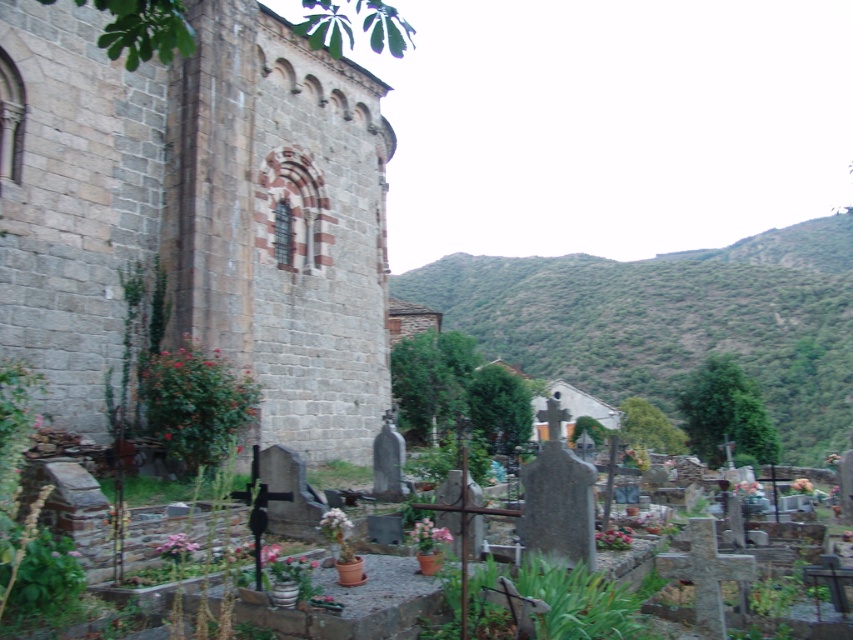
Question: Among these points, which one is nearest to the camera?

Choices:
 (A) (791, 260)
 (B) (131, 90)

Answer: (B)

Question: Can you confirm if gray stone church at center is positioned above green leafy hillside at upper right?

Choices:
 (A) no
 (B) yes

Answer: (A)

Question: Can you confirm if gray stone church at center is wider than green leafy hillside at upper right?

Choices:
 (A) yes
 (B) no

Answer: (B)

Question: Is gray stone church at center bigger than green leafy hillside at upper right?

Choices:
 (A) no
 (B) yes

Answer: (A)